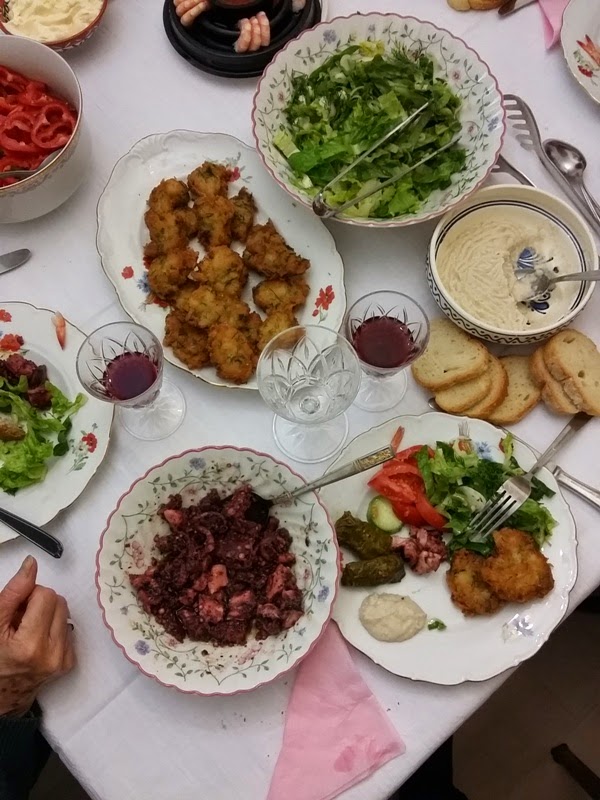
You are a GUI agent. You are given a task and a screenshot of the screen. Output one action in this format:
    pyautogui.click(x=<x>, y=<y>)
    Task: Click on the white tablecloth
    The width and height of the screenshot is (600, 800).
    Given the screenshot: What is the action you would take?
    pyautogui.click(x=173, y=98)